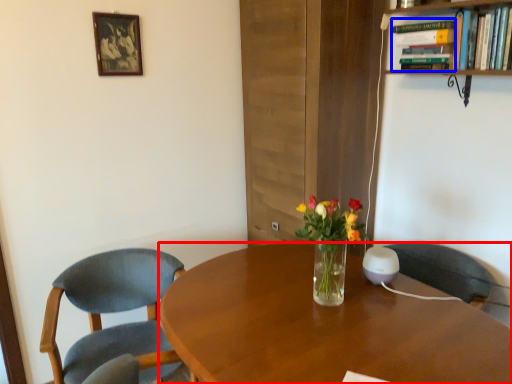
Question: Which object is closer to the camera taking this photo, desk (highlighted by a red box) or book (highlighted by a blue box)?

Choices:
 (A) desk
 (B) book

Answer: (A)